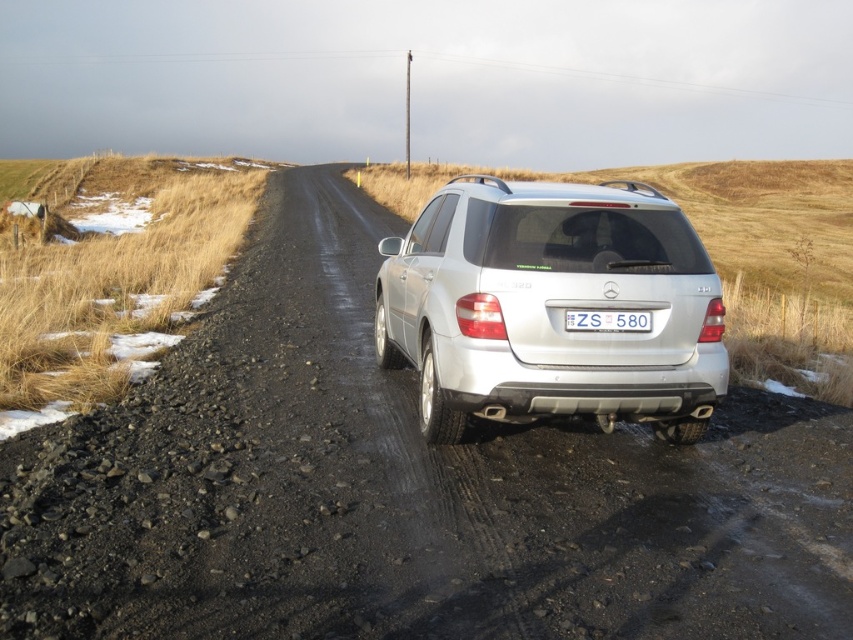
Question: Estimate the real-world distances between objects in this image. Which object is closer to the dirt track at center?

Choices:
 (A) white plastic license plate at center
 (B) silver metallic suv at center

Answer: (B)

Question: Which object appears closest to the camera in this image?

Choices:
 (A) white plastic license plate at center
 (B) silver metallic suv at center

Answer: (B)

Question: Considering the relative positions of dirt track at center and white plastic license plate at center in the image provided, where is dirt track at center located with respect to white plastic license plate at center?

Choices:
 (A) right
 (B) left

Answer: (B)

Question: Can you confirm if silver metallic suv at center is positioned above white plastic license plate at center?

Choices:
 (A) yes
 (B) no

Answer: (A)

Question: Among these objects, which one is nearest to the camera?

Choices:
 (A) white plastic license plate at center
 (B) silver metallic suv at center

Answer: (B)

Question: Does dirt track at center appear on the left side of white plastic license plate at center?

Choices:
 (A) yes
 (B) no

Answer: (A)